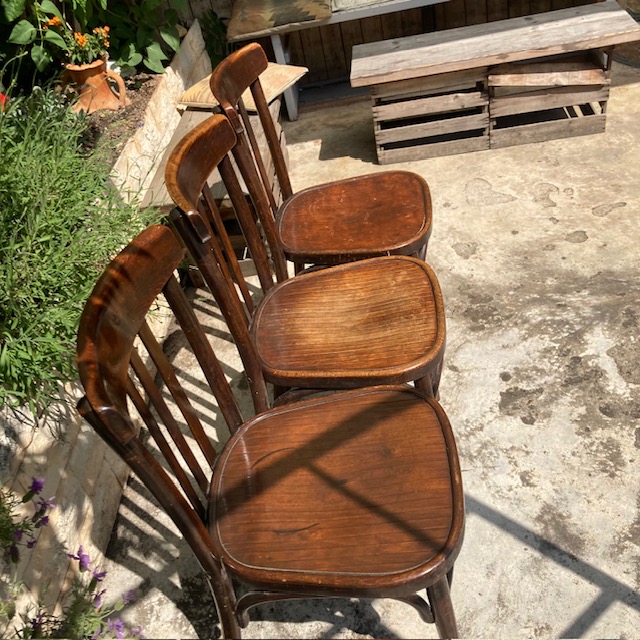
The image size is (640, 640). Identify the location of chair legs. tap(445, 620), tap(230, 625), tap(428, 380), tap(280, 387), tap(301, 266), tap(425, 248).